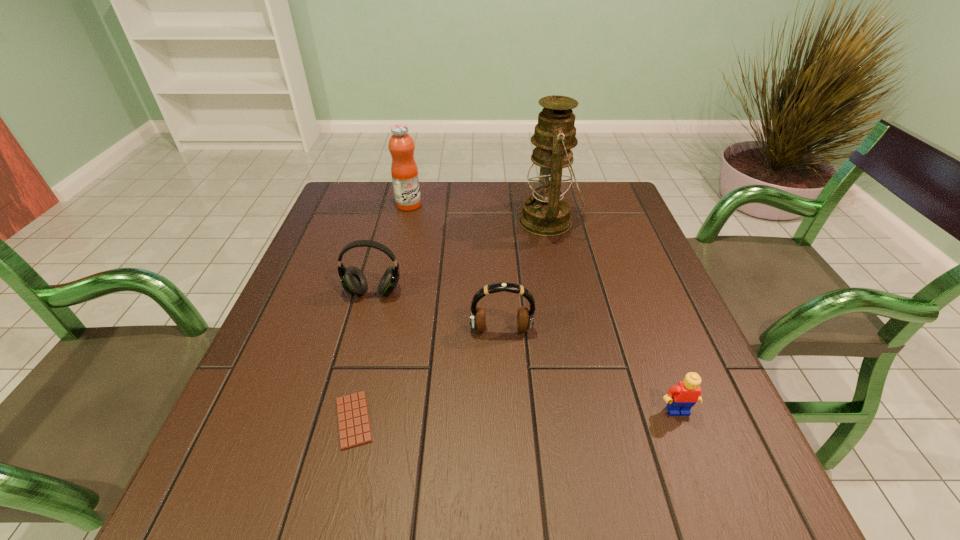
This screenshot has width=960, height=540. Find the location of `free space located 0.170m on the front label of the second tallest object`. free space located 0.170m on the front label of the second tallest object is located at coordinates (477, 205).

You are a GUI agent. You are given a task and a screenshot of the screen. Output one action in this format:
    pyautogui.click(x=<x>, y=<y>)
    Task: Click on the free region located on the ear cups of the left headset
    
    Given the screenshot: What is the action you would take?
    pyautogui.click(x=330, y=456)

Locate an element on the screen. This screenshot has width=960, height=540. vacant space located on the ear cup of the right headset is located at coordinates (506, 423).

Where is `vacant space located on the face of the rightmost object`? The width and height of the screenshot is (960, 540). vacant space located on the face of the rightmost object is located at coordinates (696, 460).

Where is `free space located on the left of the shortest object`? free space located on the left of the shortest object is located at coordinates (302, 420).

You are a GUI agent. You are given a task and a screenshot of the screen. Output one action in this format:
    pyautogui.click(x=<x>, y=<y>)
    Task: Click on the oil lamp present at the far edge
    
    Given the screenshot: What is the action you would take?
    pyautogui.click(x=546, y=213)

Locate an element on the screen. fruit juice that is at the far edge is located at coordinates (404, 170).

You are a GUI agent. You are given a task and a screenshot of the screen. Output one action in this format:
    pyautogui.click(x=<x>, y=<y>)
    Task: Click on the object present at the left edge
    The width and height of the screenshot is (960, 540).
    Given the screenshot: What is the action you would take?
    pyautogui.click(x=354, y=282)

The width and height of the screenshot is (960, 540). I want to click on object that is positioned at the right edge, so click(x=680, y=399).

Where is `vacant position at the far edge of the desktop`? vacant position at the far edge of the desktop is located at coordinates (505, 220).